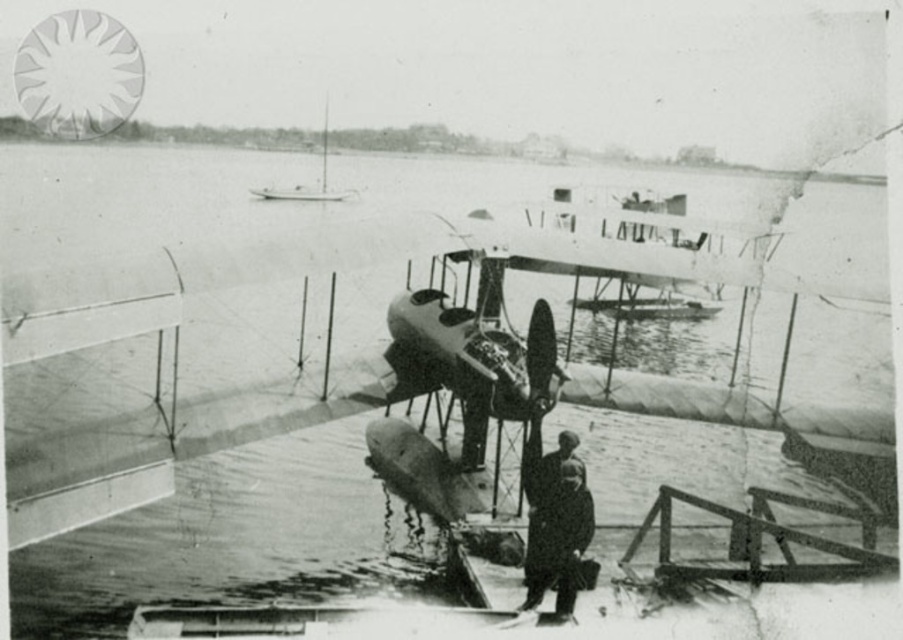
Can you confirm if dark gray uniform at center is shorter than metallic silver biplane at upper center?

Yes, dark gray uniform at center is shorter than metallic silver biplane at upper center.

Between point (554, 584) and point (322, 132), which one is positioned behind?

Point (322, 132)

Which is behind, point (548, 486) or point (313, 189)?

Point (313, 189)

This screenshot has width=903, height=640. Identify the location of dark gray uniform at center. (554, 518).